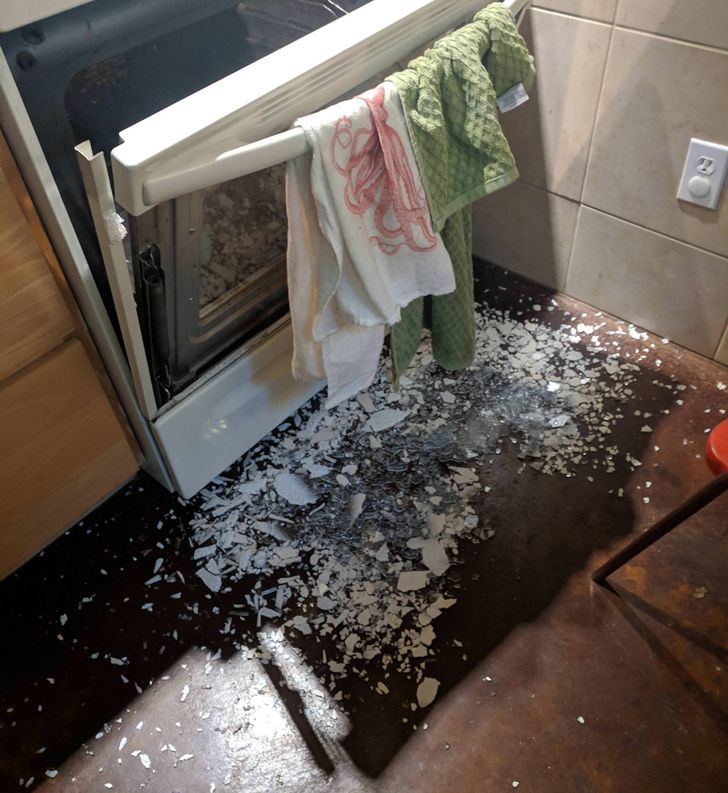
Where is `tiled wall`? tiled wall is located at coordinates (641, 144), (587, 32), (617, 239).